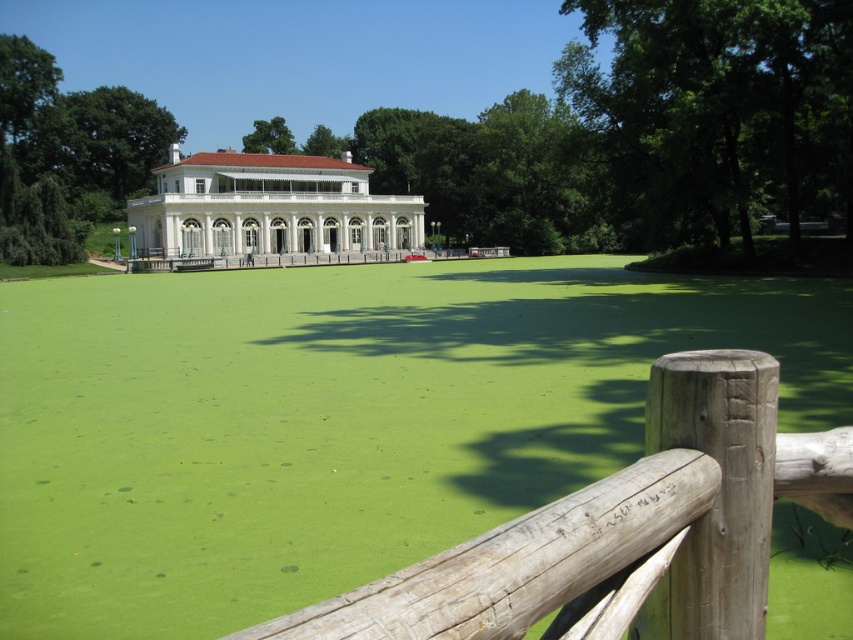
Question: Is weathered wood fence at lower center below wooden at center?

Choices:
 (A) no
 (B) yes

Answer: (B)

Question: Which point is closer to the camera?

Choices:
 (A) wooden at center
 (B) weathered wood fence at lower center

Answer: (B)

Question: Which point is farther to the camera?

Choices:
 (A) wooden at center
 (B) weathered wood fence at lower center

Answer: (A)

Question: Does weathered wood fence at lower center appear over wooden at center?

Choices:
 (A) yes
 (B) no

Answer: (B)

Question: Can you confirm if weathered wood fence at lower center is thinner than wooden at center?

Choices:
 (A) yes
 (B) no

Answer: (A)